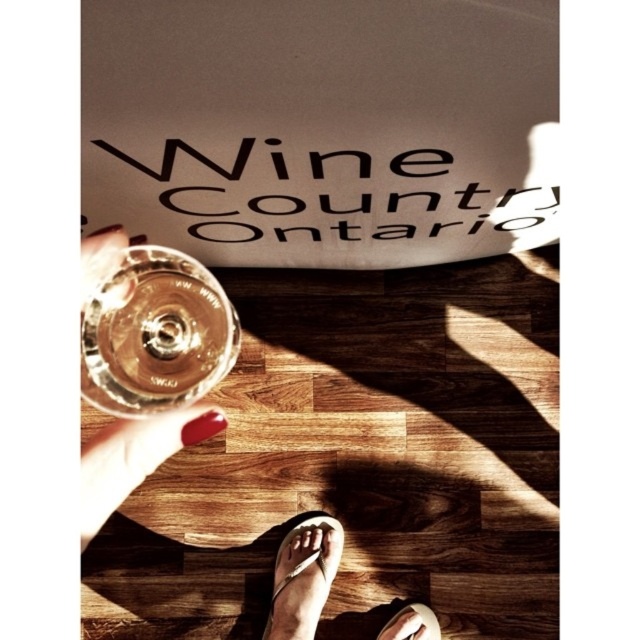
Question: Observing the image, what is the correct spatial positioning of clear glass wine glass at center in reference to white leather sandal at lower center?

Choices:
 (A) right
 (B) left

Answer: (B)

Question: Which point is closer to the camera taking this photo?

Choices:
 (A) (420, 634)
 (B) (195, 284)
 (C) (132, 468)
 (D) (304, 564)

Answer: (C)

Question: Which point is closer to the camera?

Choices:
 (A) (289, 568)
 (B) (188, 337)

Answer: (B)

Question: Is white flip-flops at lower center in front of white leather sandal at lower center?

Choices:
 (A) no
 (B) yes

Answer: (B)

Question: Does clear glass wine glass at center have a smaller size compared to white flip-flops at lower center?

Choices:
 (A) no
 (B) yes

Answer: (A)

Question: Which of these objects is positioned closest to the white flip-flop at lower center?

Choices:
 (A) white leather sandal at lower center
 (B) clear glass wine glass at center

Answer: (A)